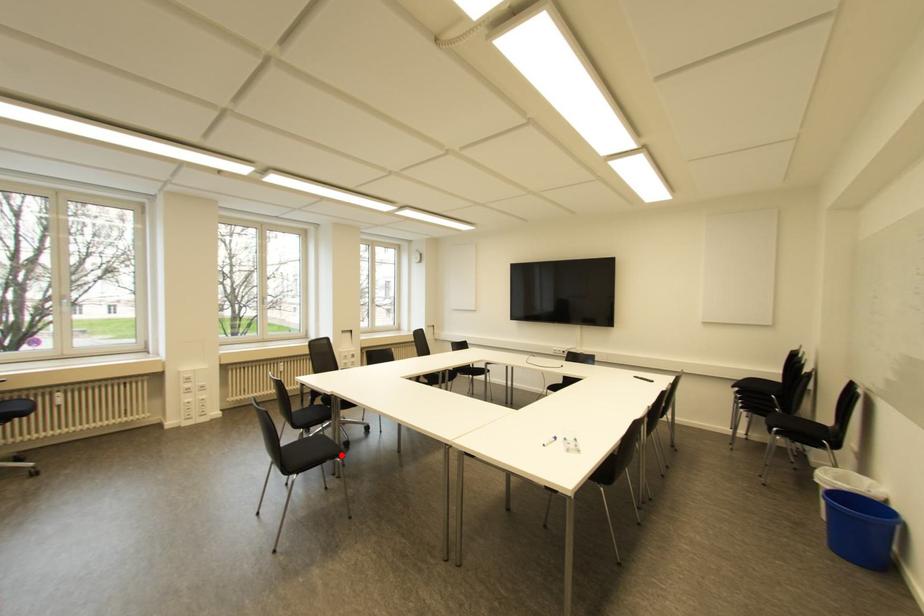
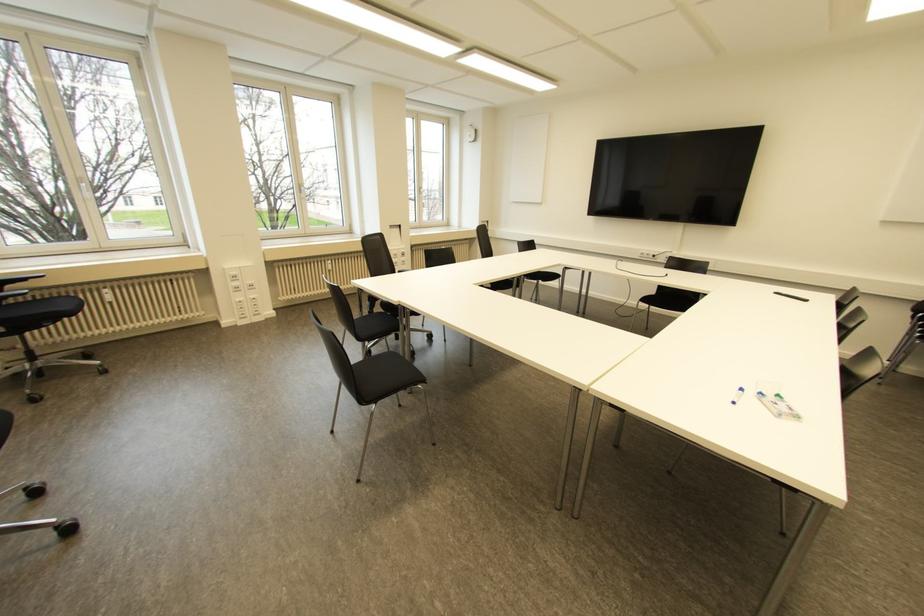
In the second image, find the point that corresponds to the highlighted location in the first image.

(422, 381)